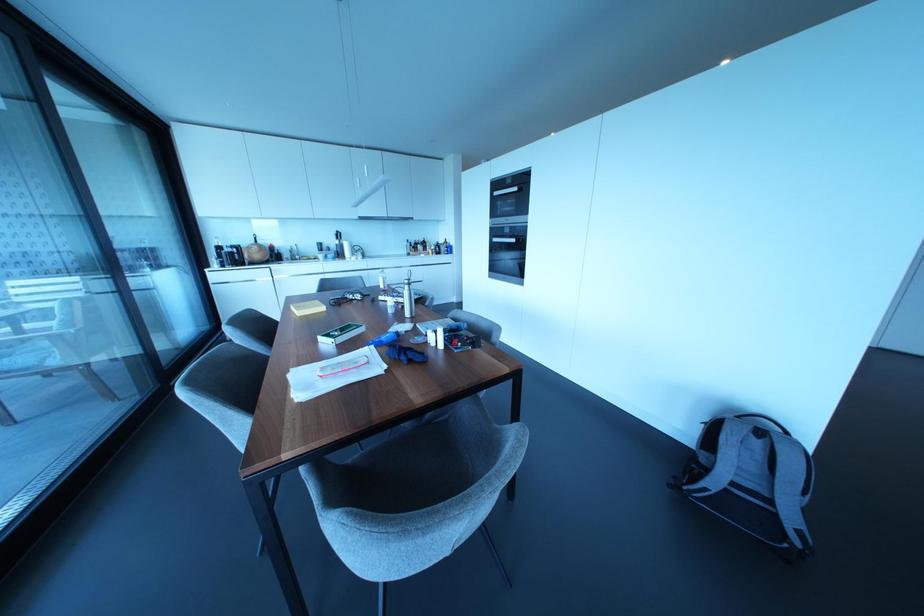
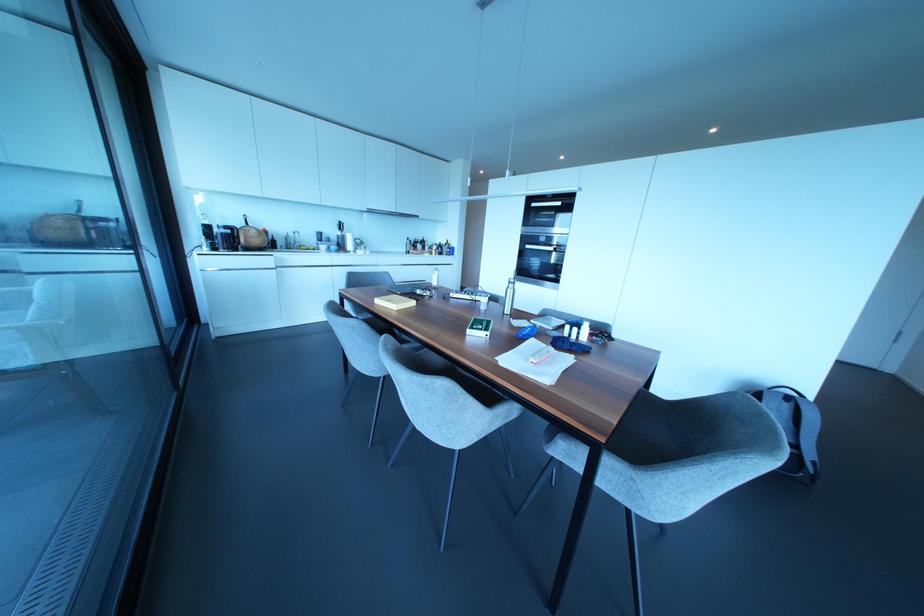
Find the pixel in the second image that matches [407,314] in the first image.

(506, 310)